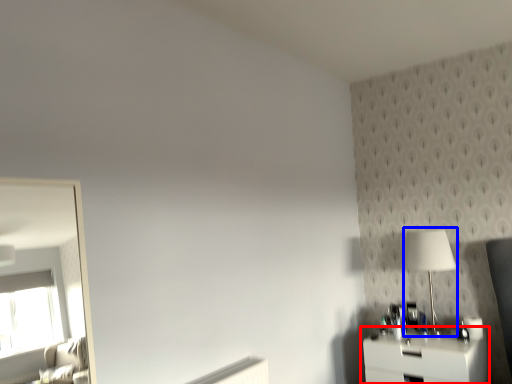
Question: Which object appears closest to the camera in this image, nightstand (highlighted by a red box) or table lamp (highlighted by a blue box)?

Choices:
 (A) nightstand
 (B) table lamp

Answer: (A)